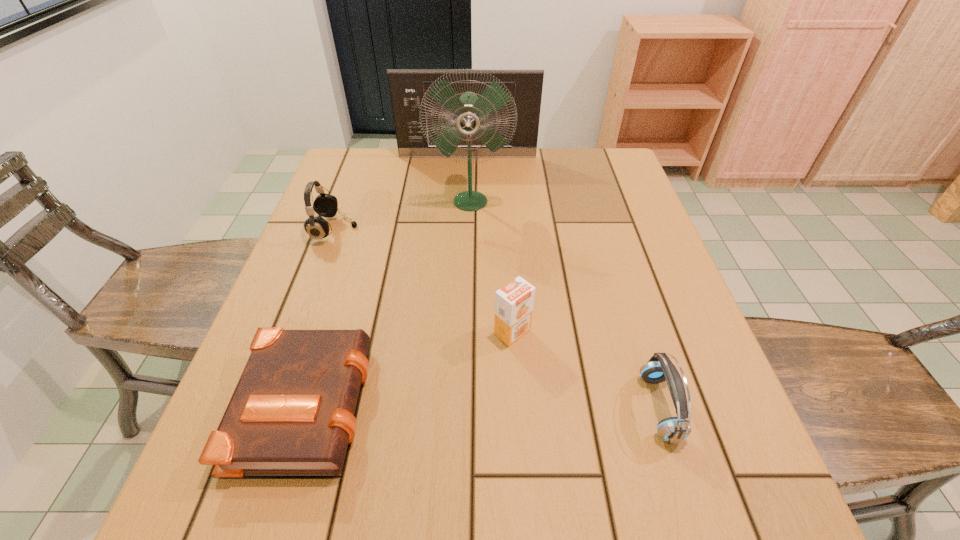
Where is `headset that is positioned at the left edge`? This screenshot has width=960, height=540. headset that is positioned at the left edge is located at coordinates (325, 205).

Identify the location of Bible that is at the left edge. The image size is (960, 540). (292, 412).

In order to click on object at the right edge in this screenshot , I will do `click(659, 368)`.

Locate an element on the screen. object that is at the near left corner is located at coordinates (292, 412).

Identify the location of vacant space at the far edge of the desktop. point(466,188).

Find the location of a particular element. This screenshot has height=540, width=960. free region at the near edge is located at coordinates [631, 505].

Where is `free location at the right edge of the desktop`? This screenshot has height=540, width=960. free location at the right edge of the desktop is located at coordinates (626, 310).

Where is `vacant space at the far left corner of the desktop`? This screenshot has width=960, height=540. vacant space at the far left corner of the desktop is located at coordinates (358, 157).

Identify the location of blank space at the near left corner of the desktop. (185, 504).

Where is `unoccupied position between the second tallest object and the orange juice`? The height and width of the screenshot is (540, 960). unoccupied position between the second tallest object and the orange juice is located at coordinates (490, 244).